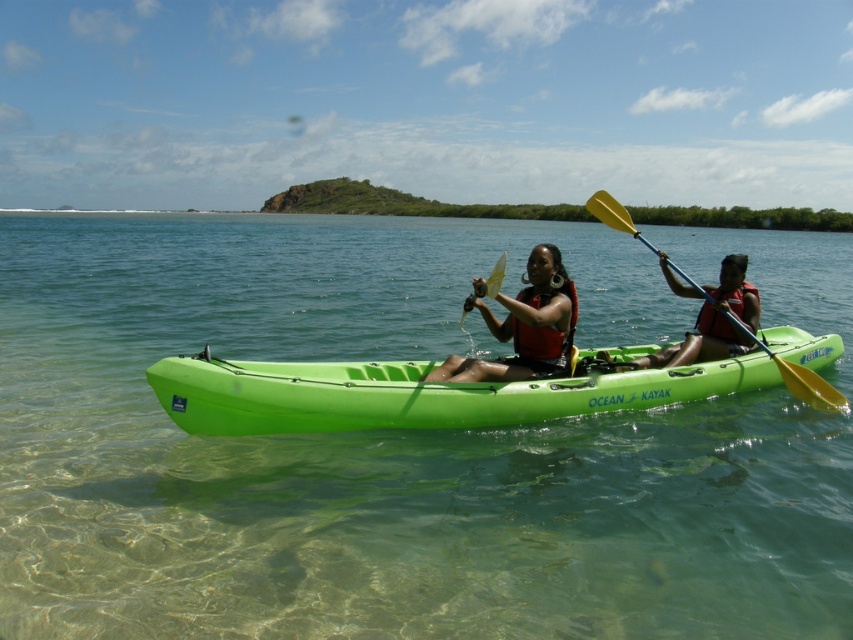
Between yellow plastic paddle at right and yellow plastic paddle at center, which one has less height?

With less height is yellow plastic paddle at right.

Based on the photo, is yellow plastic paddle at right thinner than yellow plastic paddle at center?

Indeed, yellow plastic paddle at right has a lesser width compared to yellow plastic paddle at center.

Is point (602, 195) closer to viewer compared to point (471, 300)?

That is False.

I want to click on yellow plastic paddle at right, so click(x=799, y=378).

Can you confirm if matte black life vest at center is positioned to the left of yellow plastic paddle at right?

Indeed, matte black life vest at center is positioned on the left side of yellow plastic paddle at right.

Which is in front, point (460, 369) or point (612, 212)?

Positioned in front is point (460, 369).

This screenshot has width=853, height=640. Find the location of `matte black life vest at center`. matte black life vest at center is located at coordinates (521, 324).

Based on the photo, is green plastic kayak at center shorter than matte black life vest at center?

Yes.

Image resolution: width=853 pixels, height=640 pixels. What do you see at coordinates (419, 394) in the screenshot?
I see `green plastic kayak at center` at bounding box center [419, 394].

I want to click on green plastic kayak at center, so click(419, 394).

I want to click on green plastic kayak at center, so click(x=419, y=394).